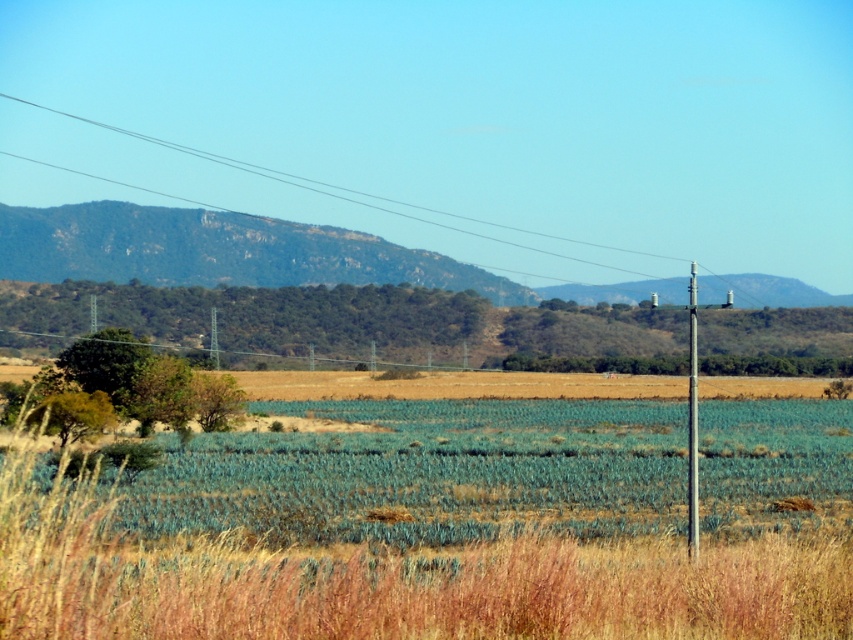
Question: Can you confirm if green rocky mountain at upper center is thinner than metallic gray telegraph pole at right?

Choices:
 (A) yes
 (B) no

Answer: (B)

Question: Among these objects, which one is farthest from the camera?

Choices:
 (A) dry grass at lower center
 (B) metallic gray telegraph pole at right
 (C) green rocky mountain at upper center

Answer: (C)

Question: Which of the following is the closest to the observer?

Choices:
 (A) green rocky mountain at upper center
 (B) metallic gray telegraph pole at right
 (C) dry grass at lower center

Answer: (C)

Question: Which object is the farthest from the green rocky mountain at upper center?

Choices:
 (A) metallic gray telegraph pole at right
 (B) dry grass at lower center

Answer: (B)

Question: Does dry grass at lower center appear under metallic gray telegraph pole at right?

Choices:
 (A) yes
 (B) no

Answer: (A)

Question: In this image, where is dry grass at lower center located relative to green rocky mountain at upper center?

Choices:
 (A) above
 (B) below

Answer: (B)